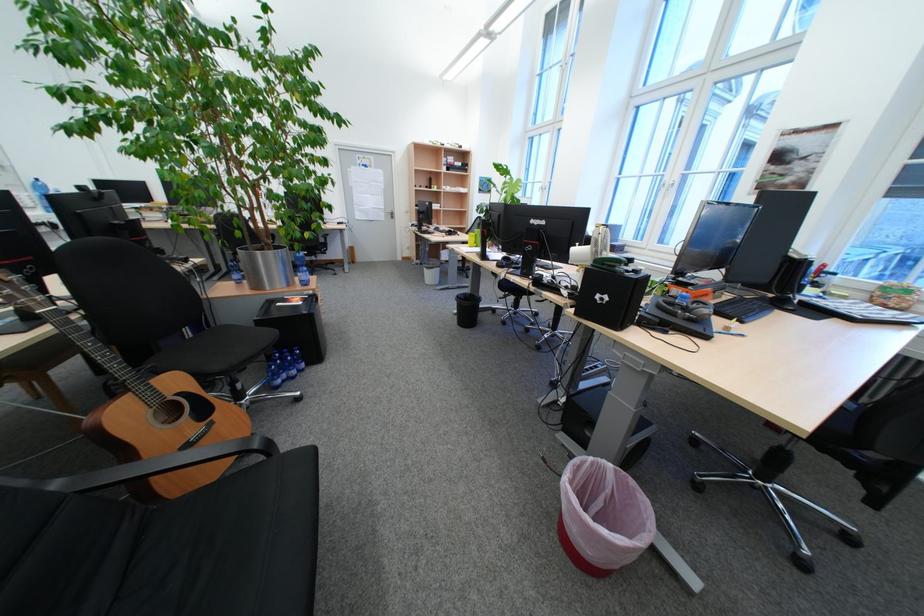
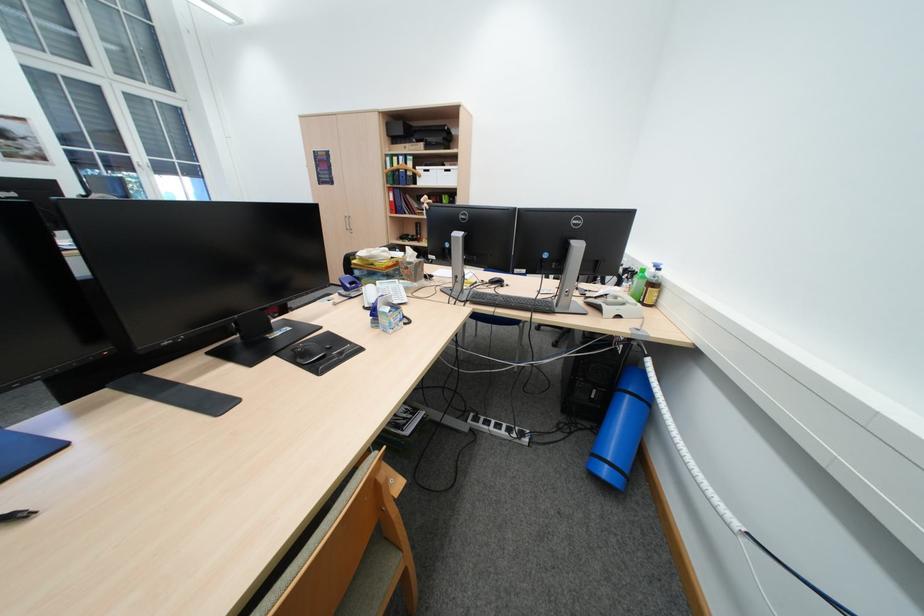
Question: I am providing you with two images of the same scene from different viewpoints. After the viewpoint changes to image2, which objects are now occluded?

Choices:
 (A) brown plastic bottle
 (B) radiator valve knob
 (C) blue rolled mat
 (D) black leather sitting surface

Answer: (D)